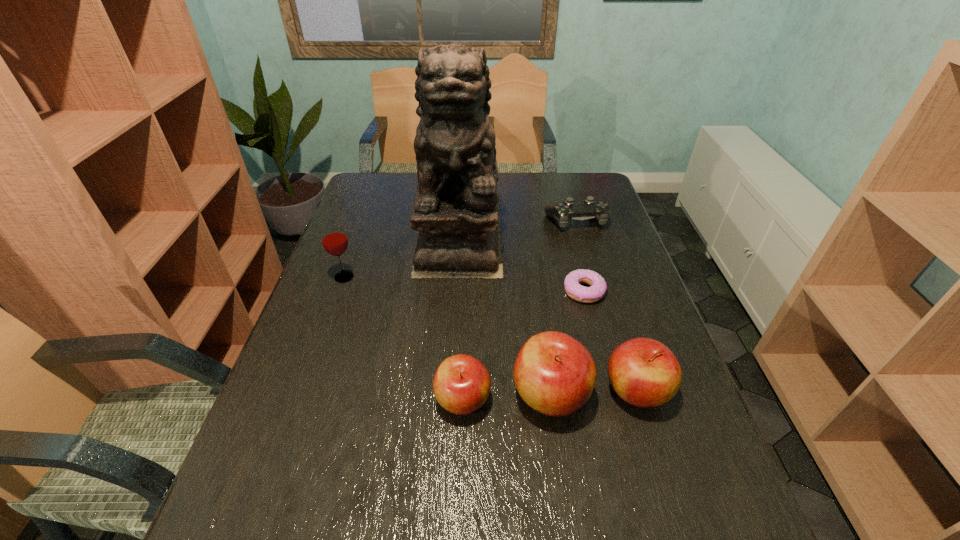
Find the location of a particular element. vacant space located 0.070m on the front of the second apple from left to right is located at coordinates (560, 464).

The image size is (960, 540). Identify the location of blank area located on the back of the rightmost apple. (618, 333).

What are the coordinates of `vacant space located 0.300m on the front-facing side of the sculpture` in the screenshot? It's located at (452, 362).

This screenshot has height=540, width=960. What are the coordinates of `vacant space positioned on the left of the doughnut` in the screenshot? It's located at (491, 291).

You are a GUI agent. You are given a task and a screenshot of the screen. Output one action in this format:
    pyautogui.click(x=<x>, y=<y>)
    Task: Click on the vacant space located 0.050m on the back of the control
    This screenshot has height=540, width=960.
    Given the screenshot: What is the action you would take?
    pyautogui.click(x=570, y=202)

Identify the location of free space located 0.380m on the right of the glass. (487, 277).

In order to click on object that is positioned at the far edge in this screenshot , I will do `click(455, 210)`.

I want to click on object that is at the left edge, so click(x=334, y=240).

Identify the location of apple situated at the right edge. Image resolution: width=960 pixels, height=540 pixels. (644, 372).

This screenshot has width=960, height=540. In order to click on doughnut that is positioned at the right edge in this screenshot , I will do `click(574, 290)`.